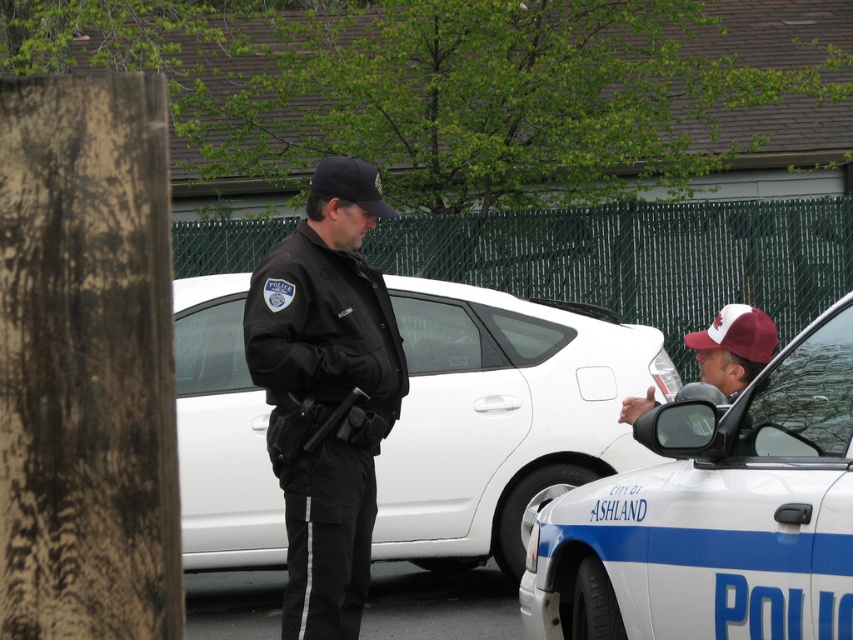
Question: Is black uniform at center to the right of maroon fabric cap at right from the viewer's perspective?

Choices:
 (A) no
 (B) yes

Answer: (A)

Question: Which of the following is the farthest from the observer?

Choices:
 (A) white matte car at center
 (B) maroon fabric cap at right
 (C) black uniform at center
 (D) white glossy police car at right

Answer: (A)

Question: Based on their relative distances, which object is farther from the maroon fabric cap at right?

Choices:
 (A) white glossy police car at right
 (B) white matte car at center

Answer: (B)

Question: Does white glossy police car at right appear over maroon fabric cap at right?

Choices:
 (A) yes
 (B) no

Answer: (B)

Question: Which point is farther to the camera?

Choices:
 (A) white glossy police car at right
 (B) black uniform at center
 (C) maroon fabric cap at right

Answer: (B)

Question: Considering the relative positions of white matte car at center and black uniform at center in the image provided, where is white matte car at center located with respect to black uniform at center?

Choices:
 (A) left
 (B) right

Answer: (B)